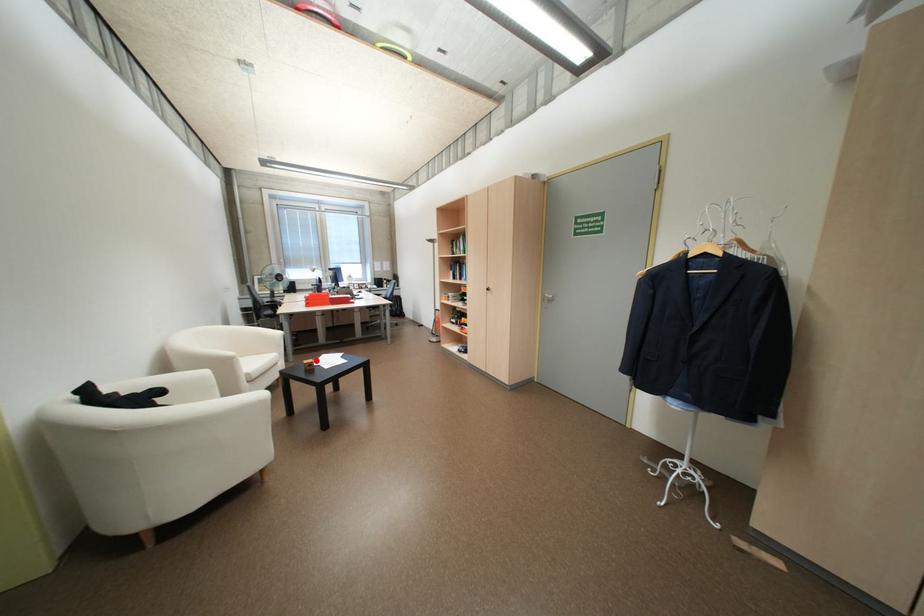
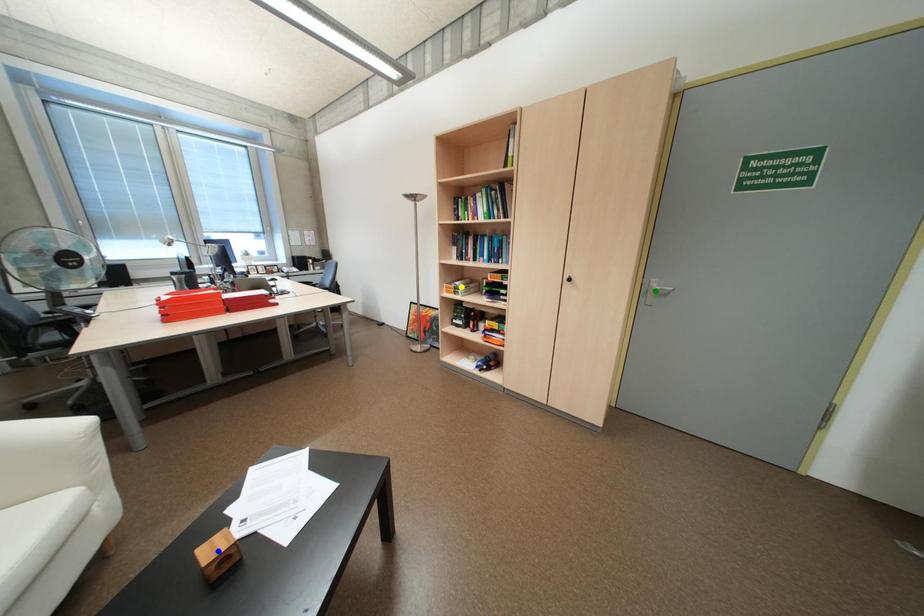
Question: I am providing you with two images of the same scene from different viewpoints. A red point is marked on the first image. You are given multiple points on the second image. Which point in image 2 is actually the same real-world point as the red point in image 1?

Choices:
 (A) yellow point
 (B) blue point
 (C) green point

Answer: (B)